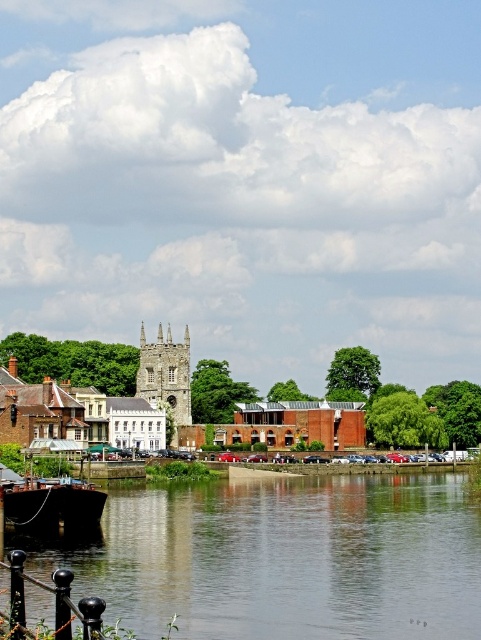
In the scene shown: You are standing at the point marked by the coordinates point (405, 404) in the riverside scene. Looking around, you see the dark barge on the left side of the river and the stone tower with spires in the middle ground. Which direction should you face to see the brown brick building at center?

The point marked by the coordinates point (405, 404) indicates the brown brick building at center, so you are already facing it.

You are a delivery drone carrying a package that requires a safe landing zone. You need to land between the brown brick building at center and the stone tower at center. The minimum safe distance required for landing is 5 meters. Can you safely land between them?

The distance between the brown brick building at center and the stone tower at center is 7.38 meters, which is greater than the required 5 meters. Therefore, the drone can safely land between them.

From the picture: You are standing at the center of the image and want to walk towards the brown brick building at center. Which direction should you move to reach it?

The brown brick building at center is already at the center of the image, so you don not need to move in any direction to reach it.